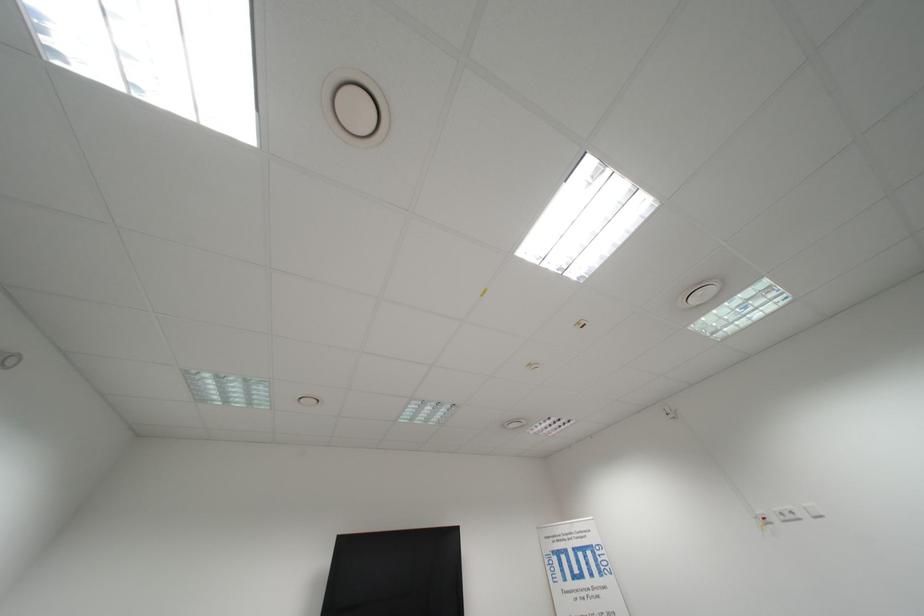
Where would you plugging in the white power outlet? Please return your answer as a coordinate pair (x, y).

(791, 514)